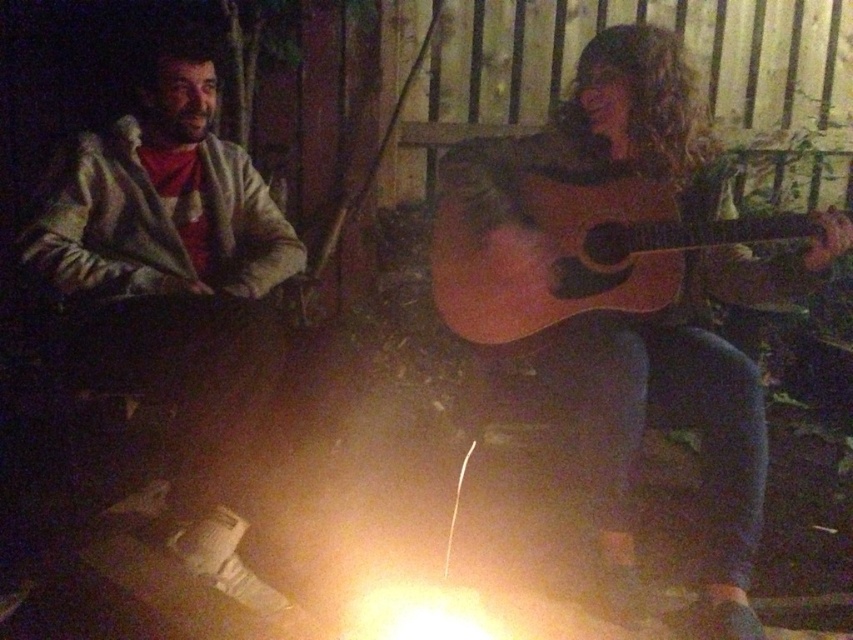
You are standing in the campfire scene and want to place a small stool between the two points marked as point (x=463, y=163) and point (x=451, y=272). Which point should the stool be closer to in order to be closer to the person playing the guitar?

The stool should be closer to point (x=463, y=163) because it is closer to the person playing the guitar, who is positioned slightly to the right of the frame.

You are a photographer trying to capture a clear shot of both the wooden acoustic guitar at right and the light brown acoustic guitar at right. Since the campfire is the main light source, which guitar will appear taller in the photo?

The wooden acoustic guitar at right will appear taller in the photo because it is taller than the light brown acoustic guitar at right.

You are a photographer trying to capture both the wooden acoustic guitar at right and the light brown acoustic guitar at right in the same frame. Which guitar should you position closer to the camera to ensure both fit within the frame?

Since the wooden acoustic guitar at right is thinner than the light brown acoustic guitar at right, positioning the wooden acoustic guitar at right closer to the camera will allow both guitars to fit within the frame more easily.